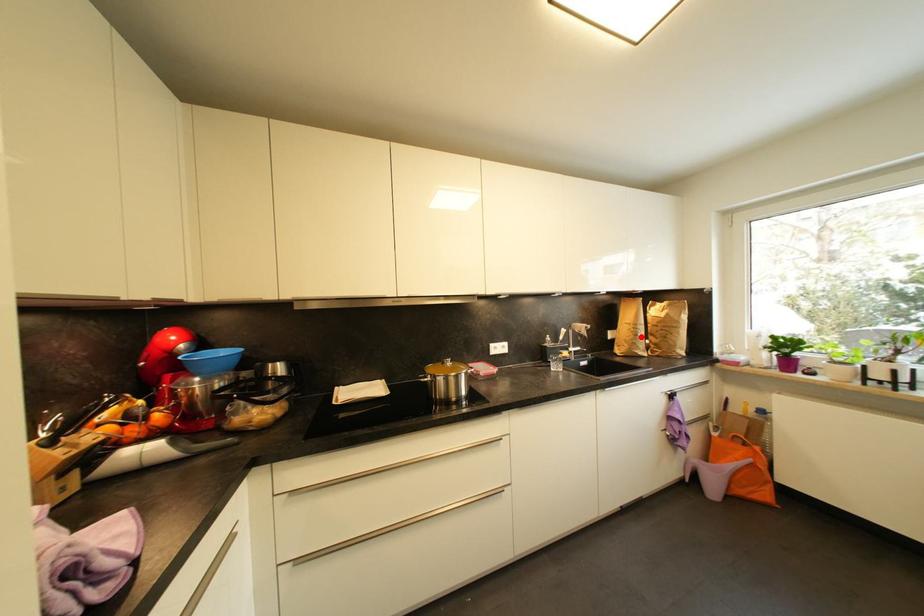
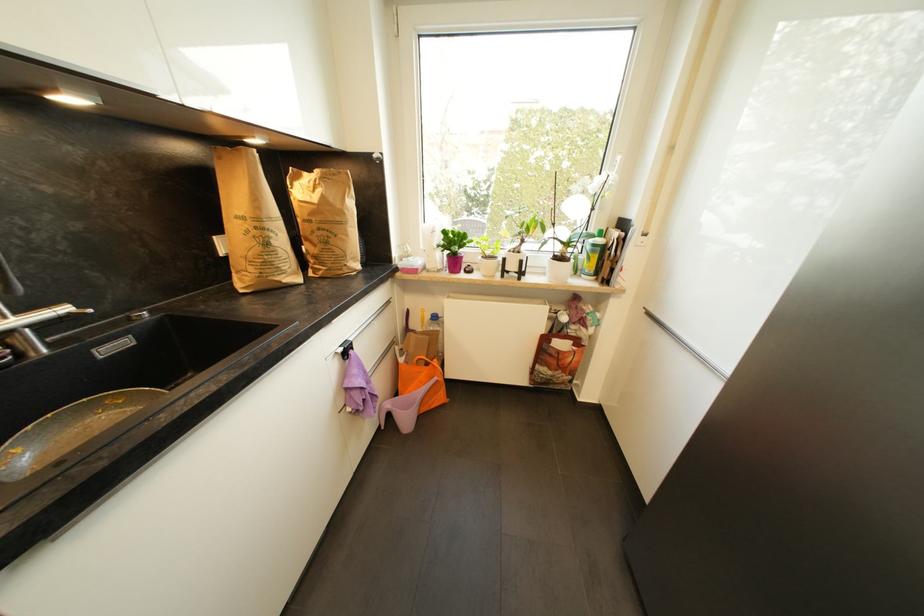
In the second image, find the point that corresponds to the highlighted location in the first image.

(272, 246)